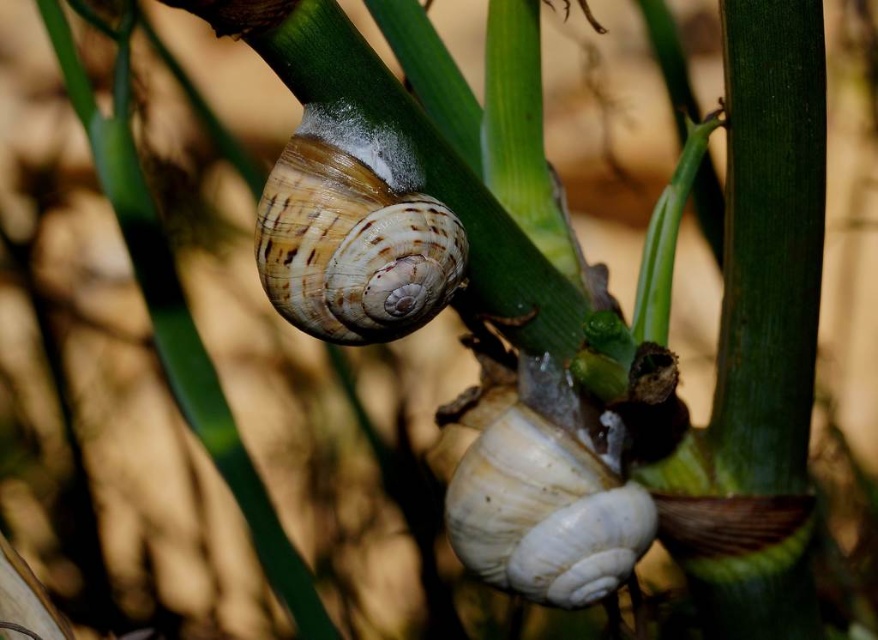
Is point (286, 205) less distant than point (468, 500)?

Yes, point (286, 205) is in front of point (468, 500).

Who is taller, brown striped shell at center or white matte snail at center?

white matte snail at center is taller.

At what (x,y) coordinates should I click in order to perform the action: click on brown striped shell at center. Please return your answer as a coordinate pair (x, y). This screenshot has height=640, width=878. Looking at the image, I should click on (354, 232).